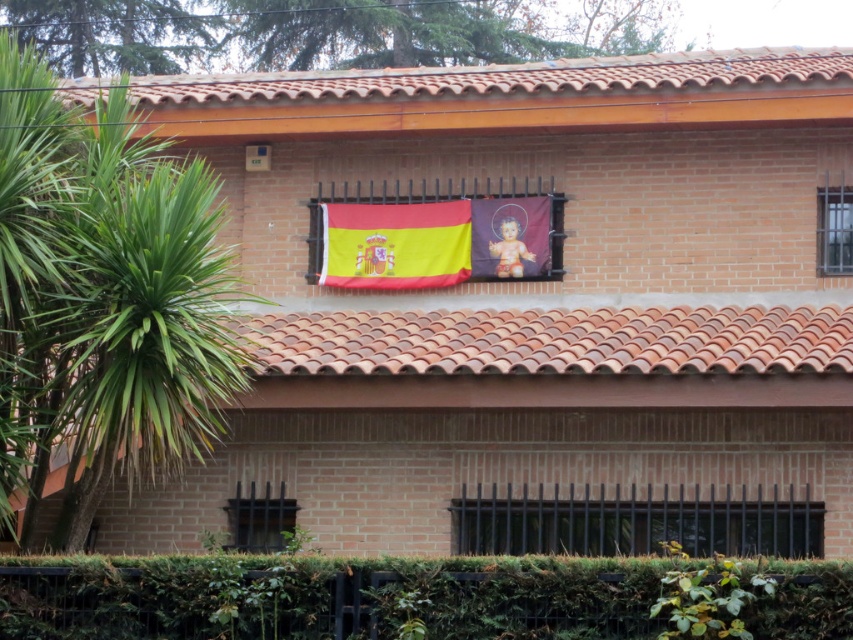
Question: Estimate the real-world distances between objects in this image. Which object is closer to the clear glass window at right?

Choices:
 (A) green leafy palm tree at left
 (B) black metal window at lower left
 (C) black metal bars at lower center
 (D) yellowmaterialflag at center

Answer: (C)

Question: Which point is closer to the camera taking this photo?

Choices:
 (A) (431, 276)
 (B) (242, 525)
 (C) (61, 371)

Answer: (C)

Question: Which point is farther to the camera?

Choices:
 (A) black metal window at lower left
 (B) black metal bars at lower center

Answer: (A)

Question: Is black metal window at lower left positioned behind clear glass window at right?

Choices:
 (A) yes
 (B) no

Answer: (B)

Question: In this image, where is green leafy palm tree at left located relative to black metal bars at lower center?

Choices:
 (A) right
 (B) left

Answer: (B)

Question: Does green leafy palm tree at left have a greater width compared to terracotta tiles at center?

Choices:
 (A) yes
 (B) no

Answer: (B)